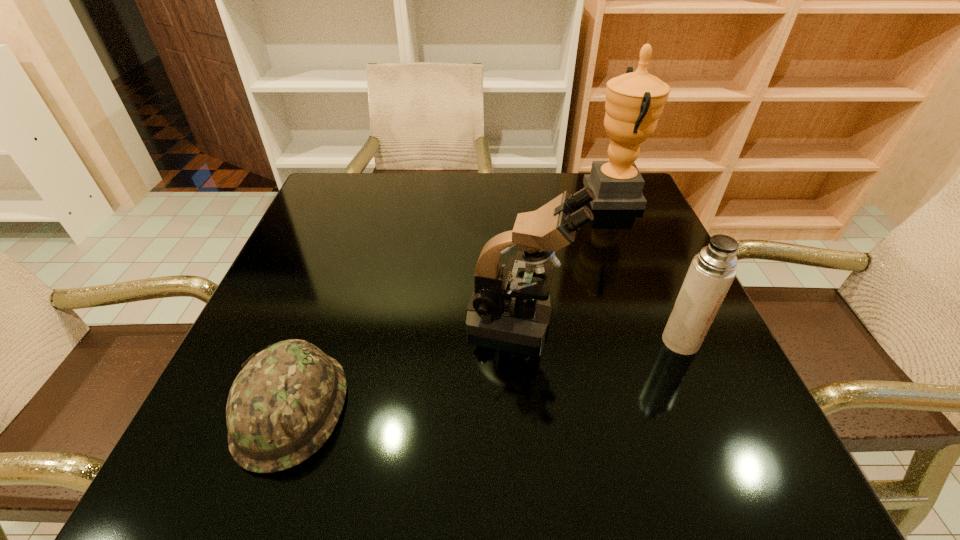
At what (x,y) coordinates should I click in order to perform the action: click on the farthest object. Please return your answer as a coordinate pair (x, y). Looking at the image, I should click on (634, 101).

Identify the location of award. Image resolution: width=960 pixels, height=540 pixels. (634, 101).

Where is `the second object from left to right`? The image size is (960, 540). the second object from left to right is located at coordinates (505, 307).

Where is `microscope`? Image resolution: width=960 pixels, height=540 pixels. microscope is located at coordinates (505, 307).

Locate an element on the screen. The width and height of the screenshot is (960, 540). thermos bottle is located at coordinates pyautogui.click(x=712, y=271).

Where is `the leftmost object`? Image resolution: width=960 pixels, height=540 pixels. the leftmost object is located at coordinates (284, 404).

Locate an element on the screen. This screenshot has height=540, width=960. the shortest object is located at coordinates (284, 404).

Identify the location of free spot located 0.390m at the front of the tallest object with handles. (443, 194).

Find the location of a particular element. The height and width of the screenshot is (540, 960). vacant space positioned at the front of the tallest object with handles is located at coordinates (516, 194).

Find the location of a particular element. The height and width of the screenshot is (540, 960). vacant area situated at the front of the tallest object with handles is located at coordinates (568, 194).